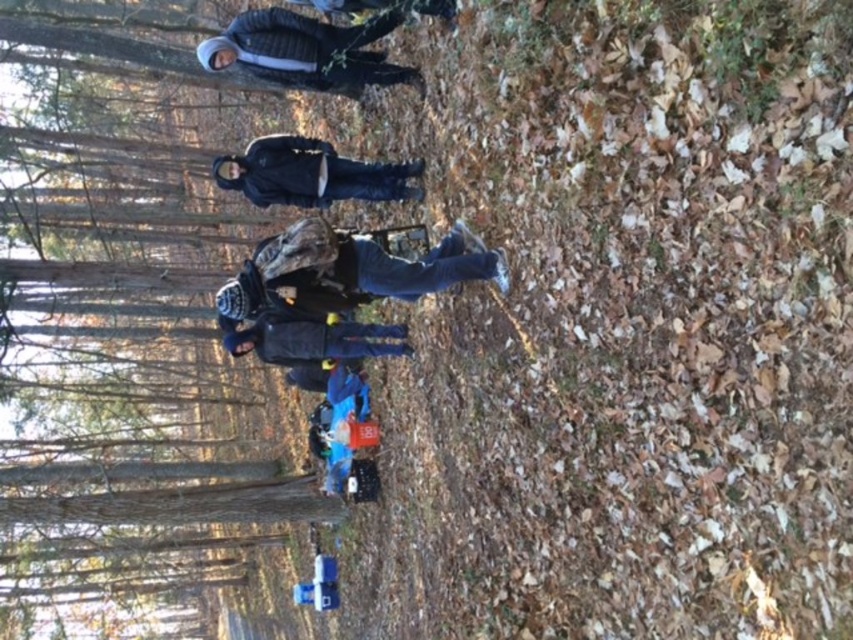
You are part of a photography group taking pictures in the forest. You need to position yourself so that the brown wood tree at upper center and the brushed metal jacket at upper center are both in your frame. Which object should you adjust your camera angle to focus on first to ensure both are visible?

You should focus on the brown wood tree at upper center first since it is to the left of the brushed metal jacket at upper center, allowing you to frame both objects by adjusting your angle from left to right.

You are standing in the forest and want to take a photo of the brown wood tree at upper center without the black matte jacket at center blocking the view. Is the tree visible from your current position?

The brown wood tree at upper center is below the black matte jacket at center, so the tree might be partially or fully blocked by the jacket. Move to a position where the jacket is not in front of the tree to get a clear view.